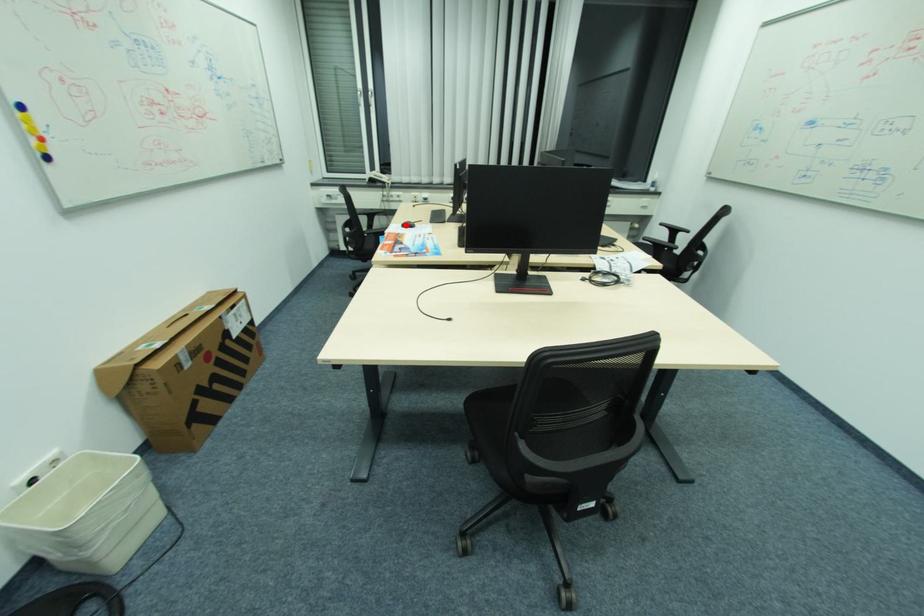
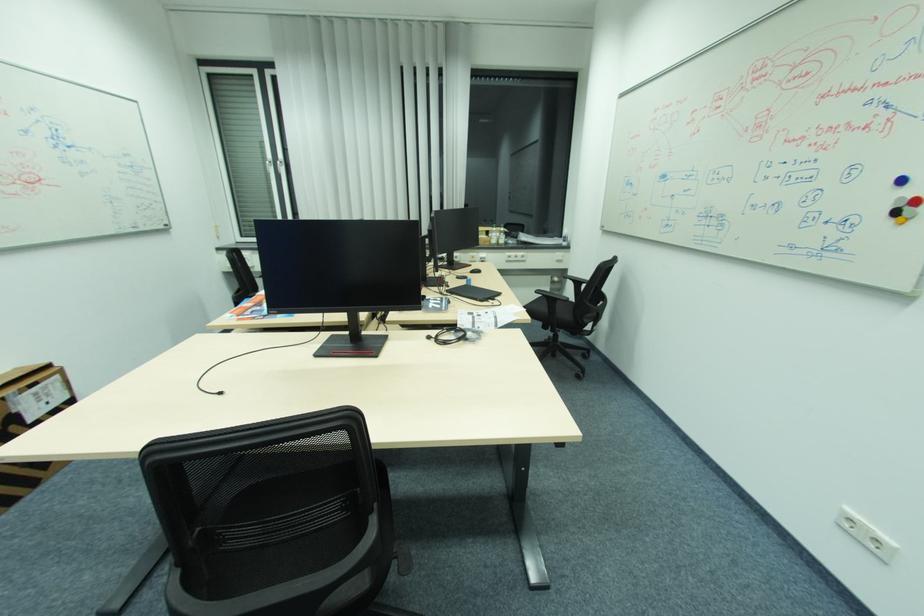
Question: I am providing you with two images of the same scene from different viewpoints. A red point is marked on the first image. At the location where the point appears in image 1, is it still visible in image 2?

Choices:
 (A) Yes
 (B) No

Answer: (B)